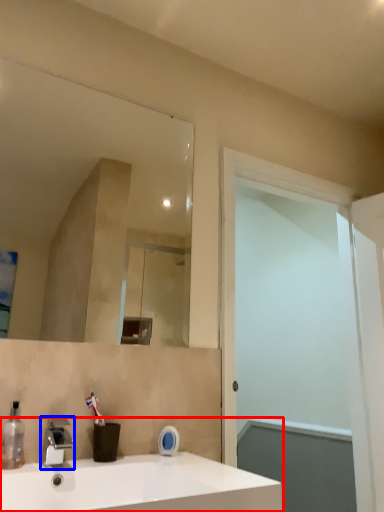
Question: Which point is further to the camera, sink (highlighted by a red box) or tap (highlighted by a blue box)?

Choices:
 (A) sink
 (B) tap

Answer: (B)